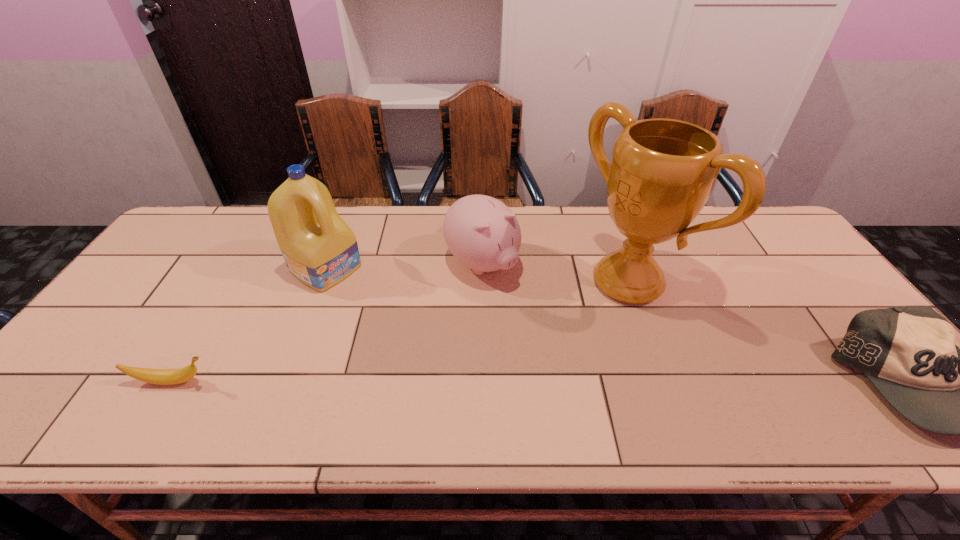
You are a GUI agent. You are given a task and a screenshot of the screen. Output one action in this format:
    pyautogui.click(x=<x>, y=<y>)
    Task: Click on the vacant position located 0.140m on the label of the second object from left to right
    The image size is (960, 540).
    Given the screenshot: What is the action you would take?
    pyautogui.click(x=385, y=305)

At what (x,y) coordinates should I click in order to perform the action: click on free spot located 0.190m on the label of the second object from left to right. Please return your answer as a coordinate pair (x, y). Looking at the image, I should click on (398, 313).

The width and height of the screenshot is (960, 540). Identify the location of vacant space located 0.380m at the snout of the third shortest object. (603, 382).

At what (x,y) coordinates should I click in order to perform the action: click on free location located 0.400m at the snout of the third shortest object. Please return your answer as a coordinate pair (x, y). The width and height of the screenshot is (960, 540). Looking at the image, I should click on (610, 389).

This screenshot has width=960, height=540. Find the location of `vacant area situated 0.200m at the snout of the third shortest object`. vacant area situated 0.200m at the snout of the third shortest object is located at coordinates [x=551, y=333].

The width and height of the screenshot is (960, 540). I want to click on vacant space located on the front of the award with the decoration, so click(510, 363).

At what (x,y) coordinates should I click in order to perform the action: click on vacant space located 0.130m on the front of the award with the decoration. Please return your answer as a coordinate pair (x, y). The image size is (960, 540). Looking at the image, I should click on (559, 333).

Find the location of `vacant space located 0.170m on the front of the award with the decoration`. vacant space located 0.170m on the front of the award with the decoration is located at coordinates (547, 340).

Find the location of `detergent that is at the far edge`. detergent that is at the far edge is located at coordinates (320, 250).

Where is `piggy bank that is at the far edge`? piggy bank that is at the far edge is located at coordinates (482, 233).